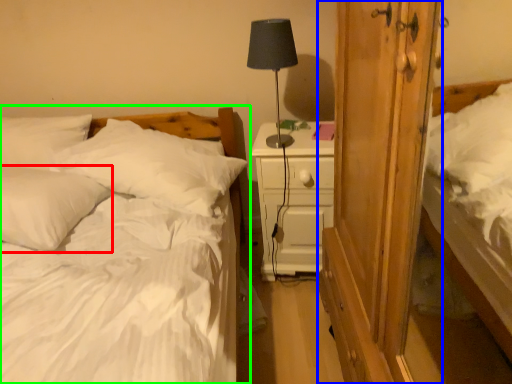
Question: Considering the real-world distances, which object is closest to pillow (highlighted by a red box)? armoire (highlighted by a blue box) or bed (highlighted by a green box).

Choices:
 (A) armoire
 (B) bed

Answer: (B)